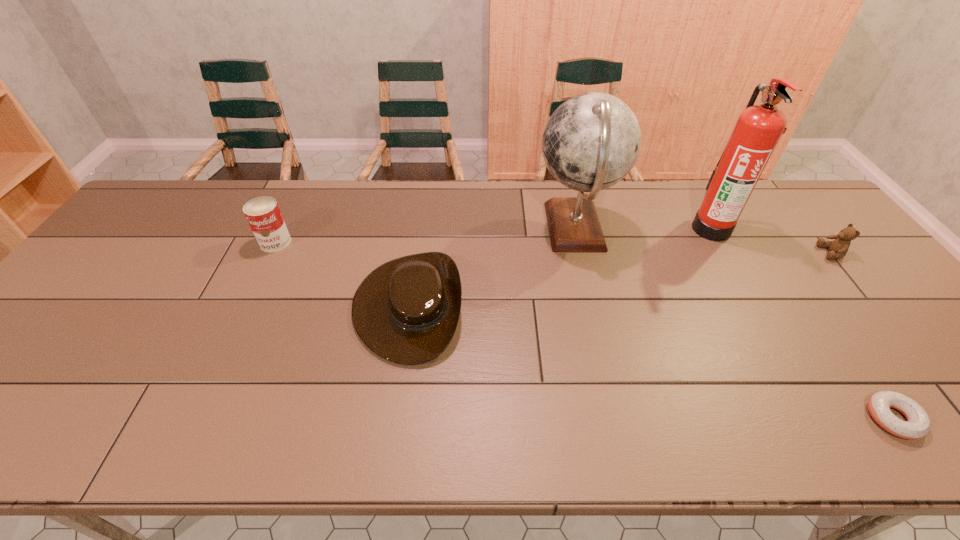
Find the location of a particular element. the fourth object from left to right is located at coordinates (758, 129).

Locate an element on the screen. This screenshot has height=540, width=960. the third object from left to right is located at coordinates click(591, 142).

The width and height of the screenshot is (960, 540). Identify the location of can. (263, 214).

Locate an element on the screen. the leftmost object is located at coordinates (263, 214).

The height and width of the screenshot is (540, 960). What are the coordinates of `the rightmost object` in the screenshot? It's located at (838, 248).

Locate an element on the screen. the second object from left to right is located at coordinates (407, 310).

Find the location of `the shortest object`. the shortest object is located at coordinates (917, 426).

Locate an element on the screen. the second object from right to left is located at coordinates (917, 426).

The height and width of the screenshot is (540, 960). I want to click on blank space located with the nozzle pointing from the back of the fire extinguisher, so coord(646,228).

At what (x,y) coordinates should I click in order to perform the action: click on blank space located 0.300m with the nozzle pointing from the back of the fire extinguisher. Please return your answer as a coordinate pair (x, y). Looking at the image, I should click on (594, 228).